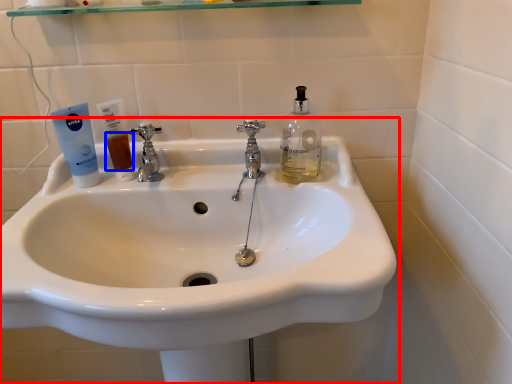
Question: Which of the following is the farthest to the observer, sink (highlighted by a red box) or liquid (highlighted by a blue box)?

Choices:
 (A) sink
 (B) liquid

Answer: (B)